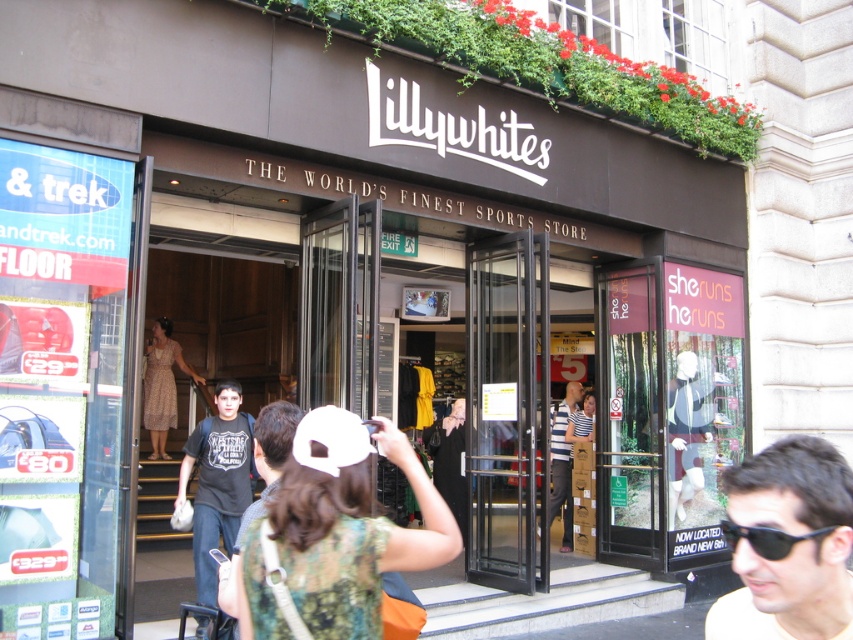
Looking at this image, you are standing at the entrance of the sports store and want to take a photo. There are two points marked in the scene. The first point is at coordinate point (318, 564) and the second is at point (811, 536). Which point is closer to your camera?

Point (318, 564) is further to the camera than point (811, 536), so the point closer to the camera is point (811, 536).